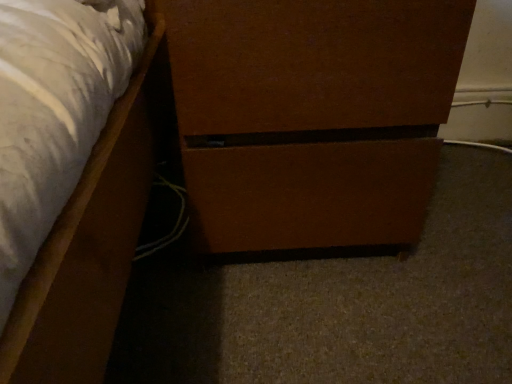
This screenshot has width=512, height=384. Identify the location of vacant area that lies to the right of matte brown chest of drawers at center. (467, 208).